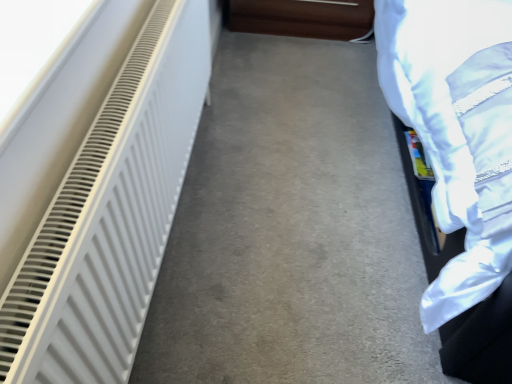
Question: Does white matte radiator at left contain brown leather couch at upper center?

Choices:
 (A) yes
 (B) no

Answer: (B)

Question: Considering the relative sizes of white matte radiator at left and brown leather couch at upper center in the image provided, is white matte radiator at left taller than brown leather couch at upper center?

Choices:
 (A) no
 (B) yes

Answer: (B)

Question: Is white matte radiator at left behind brown leather couch at upper center?

Choices:
 (A) no
 (B) yes

Answer: (A)

Question: Considering the relative sizes of white matte radiator at left and brown leather couch at upper center in the image provided, is white matte radiator at left thinner than brown leather couch at upper center?

Choices:
 (A) no
 (B) yes

Answer: (B)

Question: Is white matte radiator at left located outside brown leather couch at upper center?

Choices:
 (A) no
 (B) yes

Answer: (B)

Question: Is point (257, 23) positioned closer to the camera than point (160, 183)?

Choices:
 (A) closer
 (B) farther

Answer: (B)

Question: Which is correct: brown leather couch at upper center is inside white matte radiator at left, or outside of it?

Choices:
 (A) inside
 (B) outside

Answer: (B)

Question: Looking at the image, does brown leather couch at upper center seem bigger or smaller compared to white matte radiator at left?

Choices:
 (A) big
 (B) small

Answer: (A)

Question: Is brown leather couch at upper center wider or thinner than white matte radiator at left?

Choices:
 (A) wide
 (B) thin

Answer: (A)

Question: From a real-world perspective, is white matte radiator at left above or below brown leather couch at upper center?

Choices:
 (A) below
 (B) above

Answer: (A)

Question: Is white matte radiator at left inside the boundaries of brown leather couch at upper center, or outside?

Choices:
 (A) inside
 (B) outside

Answer: (B)

Question: Is white matte radiator at left wider or thinner than brown leather couch at upper center?

Choices:
 (A) thin
 (B) wide

Answer: (B)

Question: From the image's perspective, is white matte radiator at left positioned above or below brown leather couch at upper center?

Choices:
 (A) below
 (B) above

Answer: (A)

Question: Considering the positions of point (142, 256) and point (280, 332), is point (142, 256) closer or farther from the camera than point (280, 332)?

Choices:
 (A) closer
 (B) farther

Answer: (A)

Question: Considering the positions of white matte radiator at left and white matte radiator at left in the image, is white matte radiator at left taller or shorter than white matte radiator at left?

Choices:
 (A) tall
 (B) short

Answer: (A)